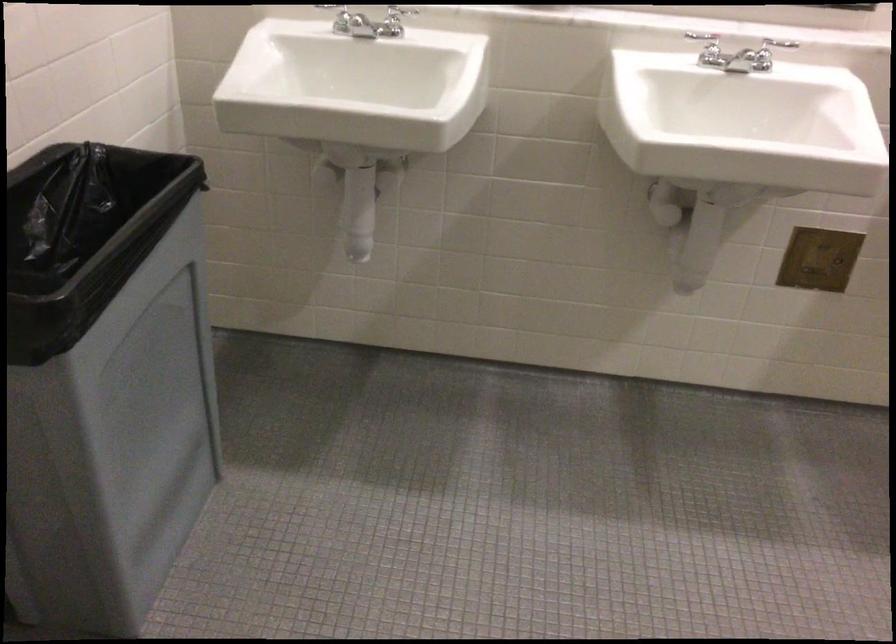
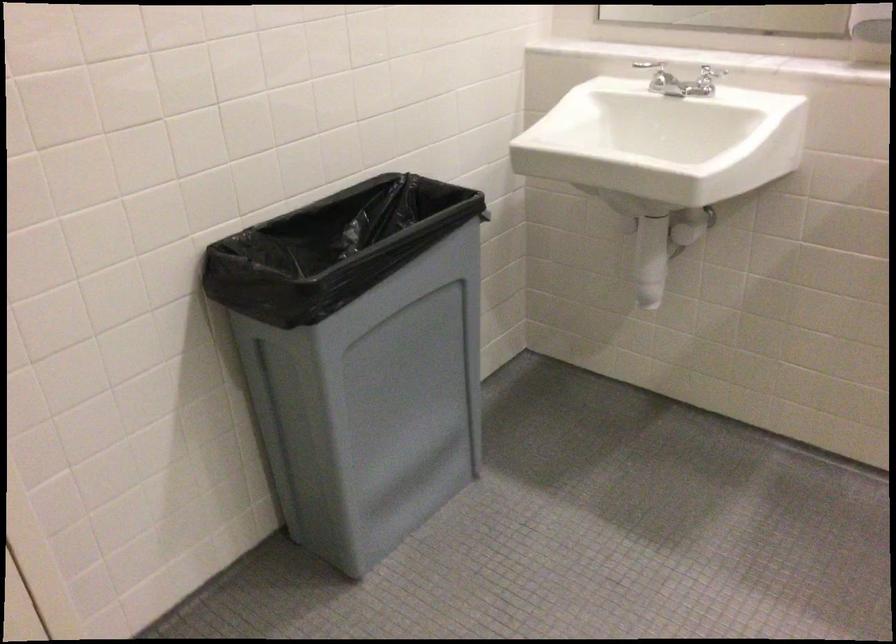
Question: The first image is from the beginning of the video and the second image is from the end. How did the camera likely rotate when shooting the video?

Choices:
 (A) Left
 (B) Right
 (C) Up
 (D) Down

Answer: (A)